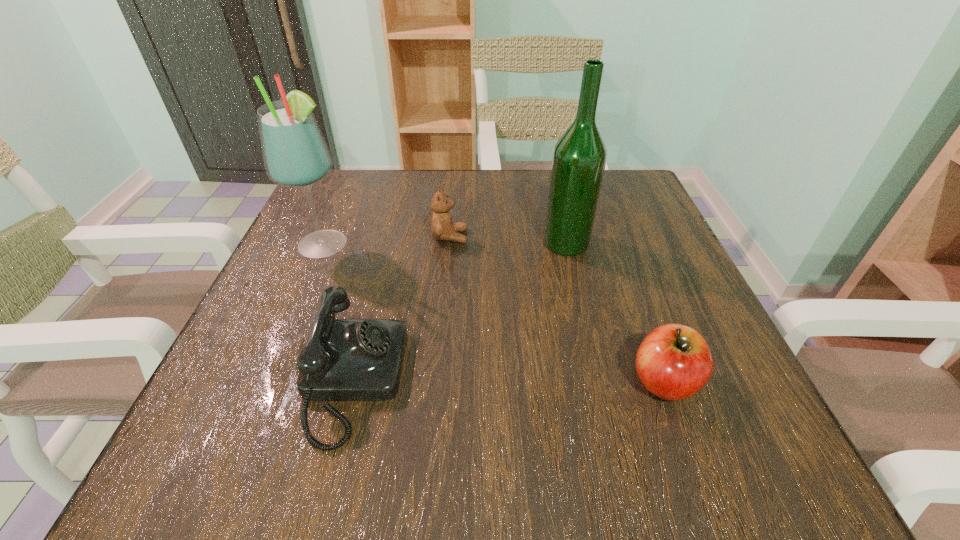
Locate an element on the screen. object situated at the far edge is located at coordinates (442, 227).

Identify the location of object that is at the near edge. (343, 359).

Where is `alcohol at the left edge`? The height and width of the screenshot is (540, 960). alcohol at the left edge is located at coordinates (295, 153).

Locate an element on the screen. This screenshot has height=540, width=960. telephone located in the left edge section of the desktop is located at coordinates (343, 359).

You are a GUI agent. You are given a task and a screenshot of the screen. Output one action in this format:
    pyautogui.click(x=<x>, y=<y>)
    Task: Click on the object that is at the right edge
    The image size is (960, 540).
    Given the screenshot: What is the action you would take?
    pyautogui.click(x=674, y=362)

Image resolution: width=960 pixels, height=540 pixels. I want to click on object located at the near left corner, so click(x=343, y=359).

Find the location of `vacant space at the far edge of the desktop`. vacant space at the far edge of the desktop is located at coordinates (422, 208).

Where is `vacant region at the near edge of the desktop`? Image resolution: width=960 pixels, height=540 pixels. vacant region at the near edge of the desktop is located at coordinates pyautogui.click(x=423, y=468).

Where is `vacant space at the left edge of the desktop`? The image size is (960, 540). vacant space at the left edge of the desktop is located at coordinates (292, 379).

The image size is (960, 540). I want to click on vacant space at the right edge, so click(722, 390).